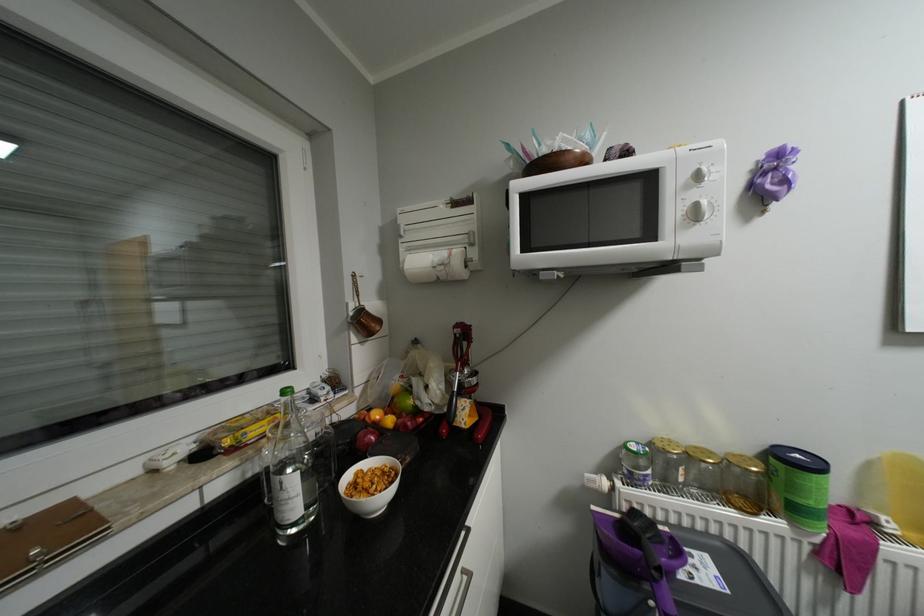
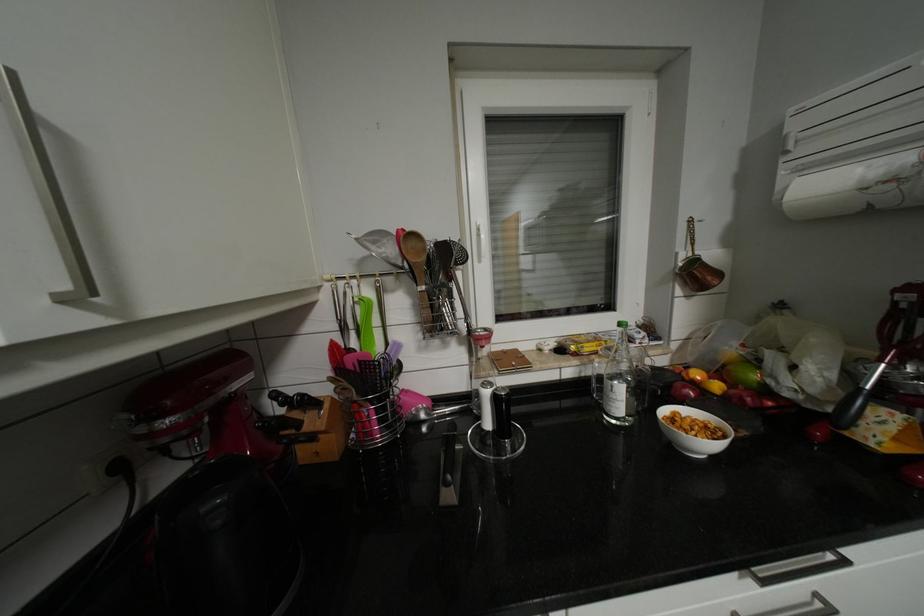
In the second image, find the point that corresponds to point 369,310 in the first image.

(702, 261)